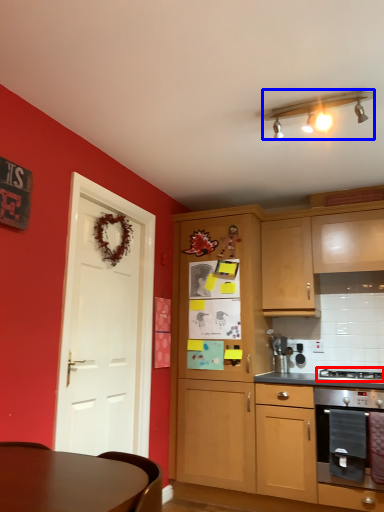
Question: Which object is further to the camera taking this photo, gas stove (highlighted by a red box) or lamp (highlighted by a blue box)?

Choices:
 (A) gas stove
 (B) lamp

Answer: (A)